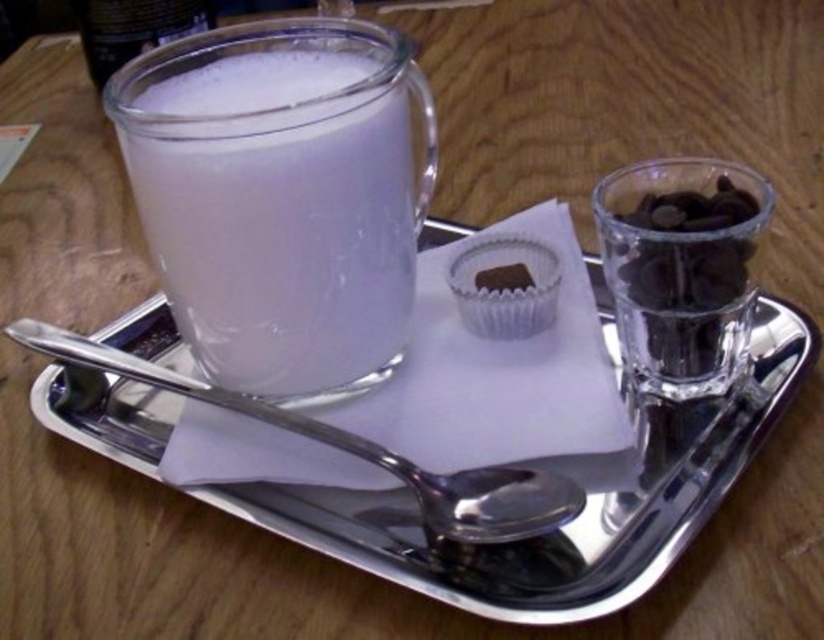
Who is shorter, white frothy milk at upper left or brushed metal spoon at lower center?

Standing shorter between the two is brushed metal spoon at lower center.

Is white frothy milk at upper left taller than brushed metal spoon at lower center?

Yes, white frothy milk at upper left is taller than brushed metal spoon at lower center.

Is point (256, 154) less distant than point (111, 348)?

Yes, point (256, 154) is closer to viewer.

Identify the location of white frothy milk at upper left. The width and height of the screenshot is (824, 640). (284, 248).

Between black chocolate at upper right and translucent glass mug at upper center, which one is positioned lower?

black chocolate at upper right

Between black chocolate at upper right and translucent glass mug at upper center, which one has less height?

translucent glass mug at upper center is shorter.

Is point (691, 392) closer to viewer compared to point (157, 6)?

Yes, it is in front of point (157, 6).

Find the location of a particular element. black chocolate at upper right is located at coordinates (682, 268).

Is translucent glass mug at upper center to the left of chocolate matte cupcake at center from the viewer's perspective?

Correct, you'll find translucent glass mug at upper center to the left of chocolate matte cupcake at center.

Image resolution: width=824 pixels, height=640 pixels. Identify the location of translucent glass mug at upper center. (134, 28).

This screenshot has width=824, height=640. In order to click on translucent glass mug at upper center in this screenshot , I will do `click(134, 28)`.

Find the location of a particular element. The image size is (824, 640). translucent glass mug at upper center is located at coordinates (134, 28).